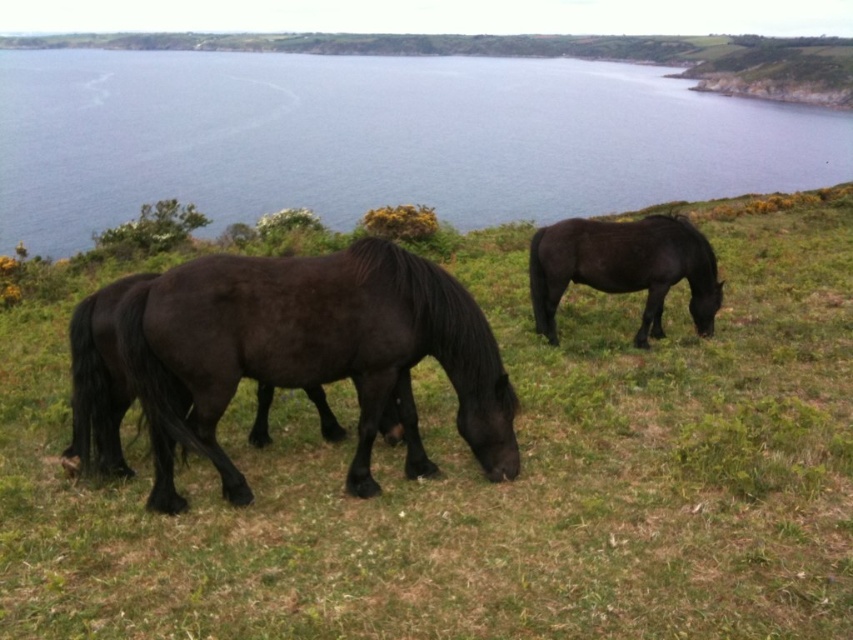
Does green grass at center come behind shiny black horse at center?

No, it is in front of shiny black horse at center.

Is green grass at center thinner than shiny black horse at center?

No.

Does point (428, 592) come farther from viewer compared to point (222, 385)?

No.

Identify the location of green grass at center. (488, 483).

Is blue water at upper center in front of shiny black horse at center?

No, it is behind shiny black horse at center.

Does blue water at upper center have a greater height compared to shiny black horse at center?

Indeed, blue water at upper center has a greater height compared to shiny black horse at center.

Where is `blue water at upper center`? This screenshot has height=640, width=853. blue water at upper center is located at coordinates (378, 138).

Can you confirm if shiny black horse at center is positioned to the left of black glossy horse at center?

Yes, shiny black horse at center is to the left of black glossy horse at center.

Is shiny black horse at center positioned at the back of black glossy horse at center?

No, it is not.

Who is more distant from viewer, (383, 298) or (672, 228)?

The point (672, 228) is more distant.

Find the location of a particular element. Image resolution: width=853 pixels, height=640 pixels. shiny black horse at center is located at coordinates (309, 353).